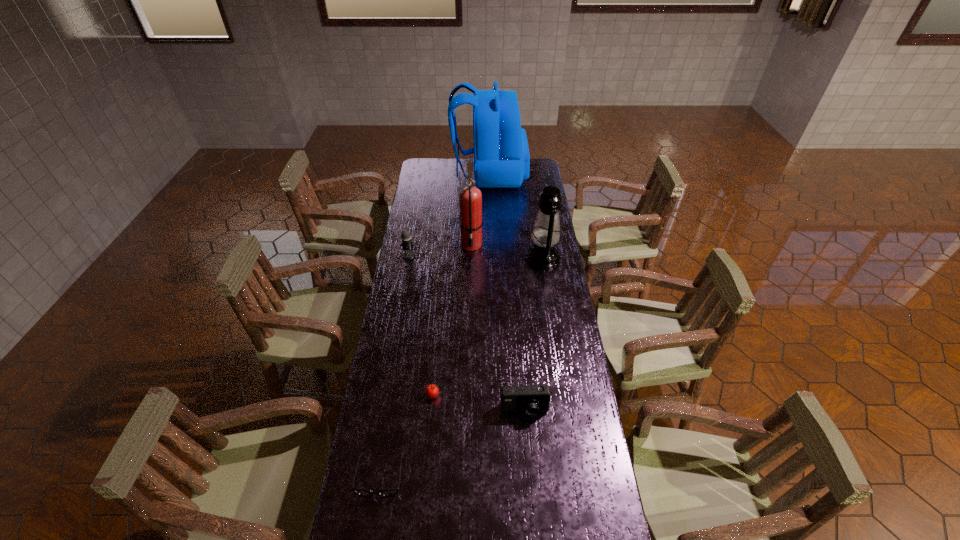
What are the coordinates of `spectacles positioned at the left edge` in the screenshot? It's located at (362, 492).

The height and width of the screenshot is (540, 960). I want to click on backpack at the right edge, so click(x=501, y=154).

Locate an element on the screen. oil lamp that is at the right edge is located at coordinates (546, 233).

Find the location of a particular element. The image size is (960, 540). camera that is at the right edge is located at coordinates (532, 399).

Image resolution: width=960 pixels, height=540 pixels. Identify the location of object that is at the far right corner. (501, 154).

The image size is (960, 540). Identify the location of vacant space at the left edge of the desktop. (360, 519).

Find the location of a particular element. vacant space at the right edge is located at coordinates 534,207.

In order to click on free area in between the spectacles and the microphone in this screenshot , I will do `click(395, 366)`.

You are a GUI agent. You are given a task and a screenshot of the screen. Output one action in this format:
    pyautogui.click(x=<x>, y=<y>)
    Task: Click on the free point between the oil lamp and the spectacles
    Image resolution: width=960 pixels, height=540 pixels.
    Given the screenshot: What is the action you would take?
    pyautogui.click(x=462, y=367)

Where is `vacant region between the shortest object and the fire extinguisher`? vacant region between the shortest object and the fire extinguisher is located at coordinates (426, 360).